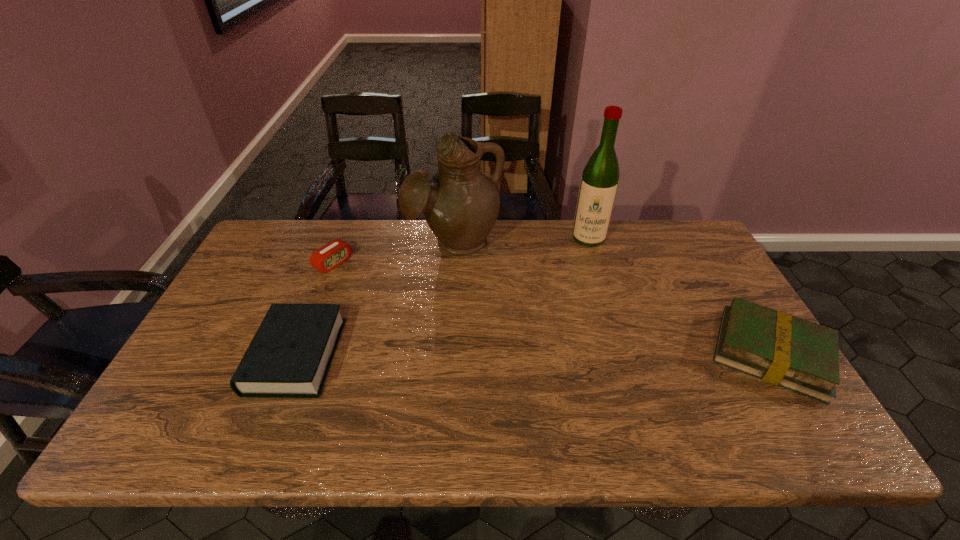
Find the location of a particular element. The width and height of the screenshot is (960, 540). free location located on the label of the liquor is located at coordinates (584, 305).

What are the coordinates of `vacant space located 0.230m at the spout of the pitcher` in the screenshot? It's located at (481, 320).

You are a GUI agent. You are given a task and a screenshot of the screen. Output one action in this format:
    pyautogui.click(x=<x>, y=<y>)
    Task: Click on the free spot located at the spout of the pitcher
    Image resolution: width=960 pixels, height=540 pixels.
    Given the screenshot: What is the action you would take?
    coord(468,278)

Where is `vacant region located 0.130m at the spout of the pitcher`? This screenshot has width=960, height=540. vacant region located 0.130m at the spout of the pitcher is located at coordinates (473, 295).

This screenshot has height=540, width=960. I want to click on blank space located 0.260m on the front-facing side of the alarm clock, so click(x=406, y=307).

Locate an element on the screen. vacant region located on the front-facing side of the alarm clock is located at coordinates (419, 315).

Identify the location of free space located 0.280m on the front-facing side of the alarm clock. (411, 310).

Locate an element on the screen. This screenshot has width=960, height=540. liquor at the far edge is located at coordinates (600, 178).

This screenshot has height=540, width=960. Find the location of `pitcher that is at the far edge`. pitcher that is at the far edge is located at coordinates (460, 204).

This screenshot has height=540, width=960. In order to click on alarm clock present at the far edge in this screenshot , I will do `click(331, 255)`.